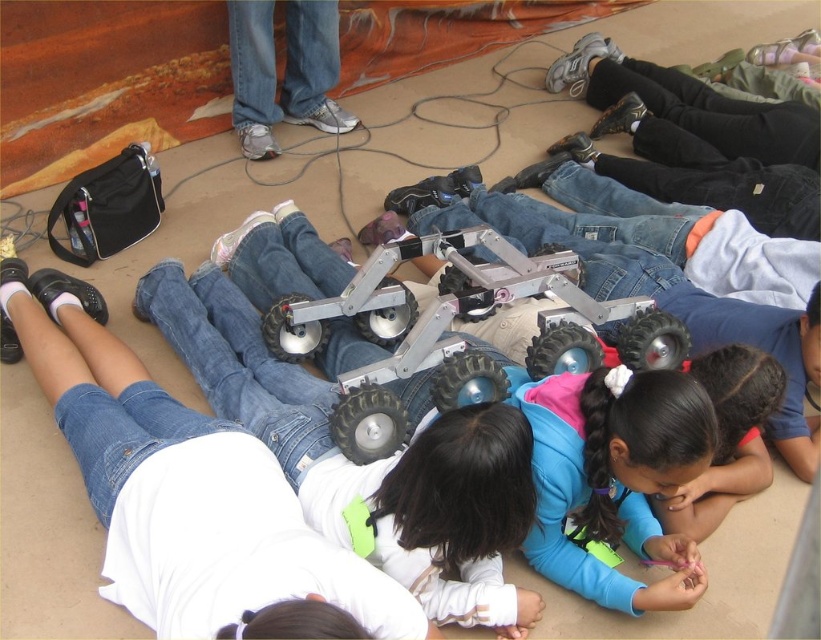
Question: Is blue matte jacket at center in front of metallic/plastic robot at center?

Choices:
 (A) no
 (B) yes

Answer: (B)

Question: Which point appears farthest from the camera in this image?

Choices:
 (A) (641, 525)
 (B) (308, 321)

Answer: (B)

Question: Does blue matte jacket at center appear on the right side of metallic/plastic robot at center?

Choices:
 (A) yes
 (B) no

Answer: (A)

Question: Which point appears closest to the camera in this image?

Choices:
 (A) (379, 253)
 (B) (686, 477)

Answer: (B)

Question: Can you confirm if blue matte jacket at center is positioned above metallic/plastic robot at center?

Choices:
 (A) yes
 (B) no

Answer: (B)